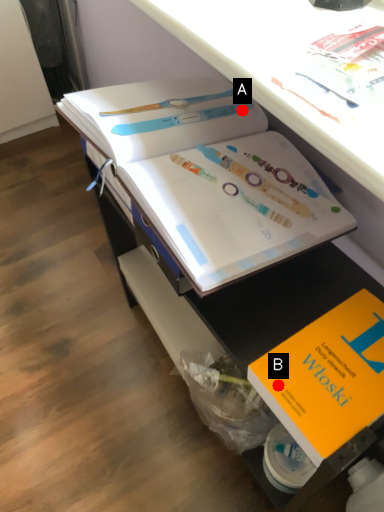
Question: Two points are circled on the image, labeled by A and B beside each circle. Which point is closer to the camera?

Choices:
 (A) A is closer
 (B) B is closer

Answer: (B)